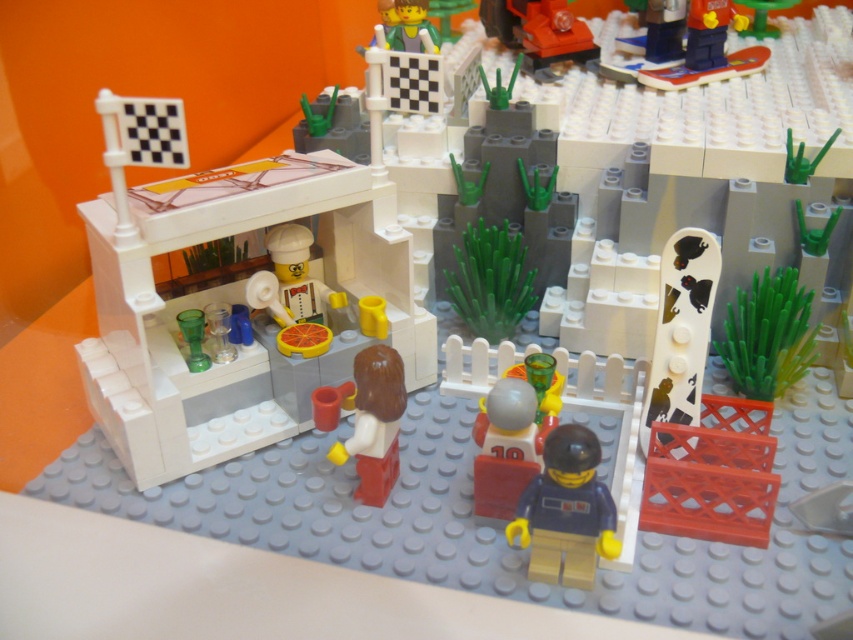
You are a Lego figure trying to see over the white plastic stand at center to spot the shiny orange car at upper center. Can you see it easily?

The white plastic stand at center is much taller than the shiny orange car at upper center, so it might block your view of the shiny orange car at upper center unless you move closer or find a higher vantage point.

You are a Lego figure standing at the edge of the scene. You see the white plastic stand at center and the shiny orange car at upper center. Which object is positioned higher up in the image?

The shiny orange car at upper center is positioned higher up in the image than the white plastic stand at center, as it is located above it.